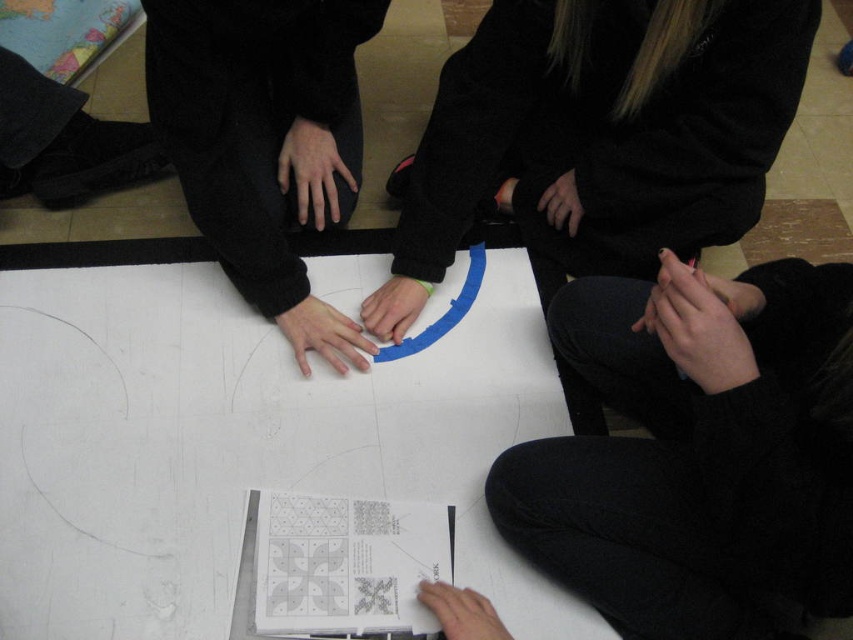
Can you confirm if white paper at center is thinner than matte blue circle at center?

Incorrect, white paper at center's width is not less than matte blue circle at center's.

Who is taller, white paper at center or matte blue circle at center?

Standing taller between the two is white paper at center.

Identify the location of white paper at center. Image resolution: width=853 pixels, height=640 pixels. (241, 444).

Is matte black hand at center closer to the viewer compared to smooth white paper at lower center?

No, matte black hand at center is further to the viewer.

From the picture: Which is more to the left, matte black hand at center or smooth white paper at lower center?

Positioned to the left is matte black hand at center.

You are a GUI agent. You are given a task and a screenshot of the screen. Output one action in this format:
    pyautogui.click(x=<x>, y=<y>)
    Task: Click on the matte black hand at center
    The height and width of the screenshot is (640, 853).
    Given the screenshot: What is the action you would take?
    pyautogui.click(x=314, y=173)

Is the position of white paper at center less distant than that of matte black hand at lower right?

That is False.

Between point (187, 429) and point (659, 253), which one is positioned behind?

The point (187, 429) is more distant.

At what (x,y) coordinates should I click in order to perform the action: click on white paper at center. Please return your answer as a coordinate pair (x, y). The height and width of the screenshot is (640, 853). Looking at the image, I should click on (241, 444).